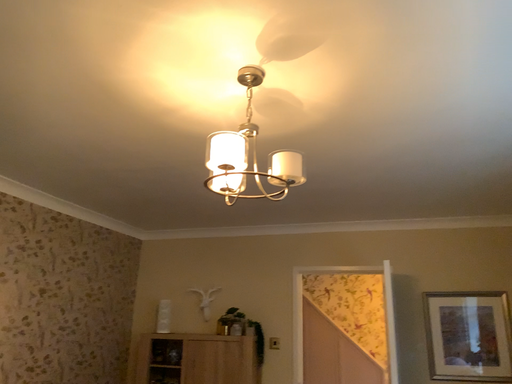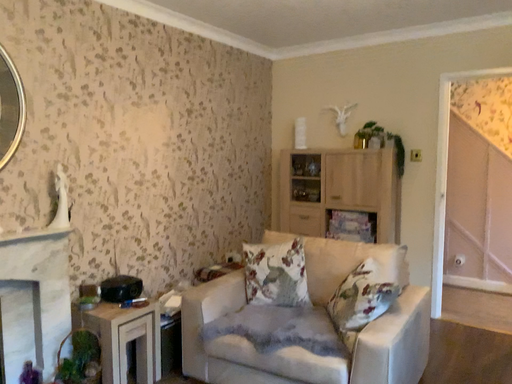
Question: Which way did the camera rotate in the video?

Choices:
 (A) rotated right
 (B) rotated left

Answer: (B)